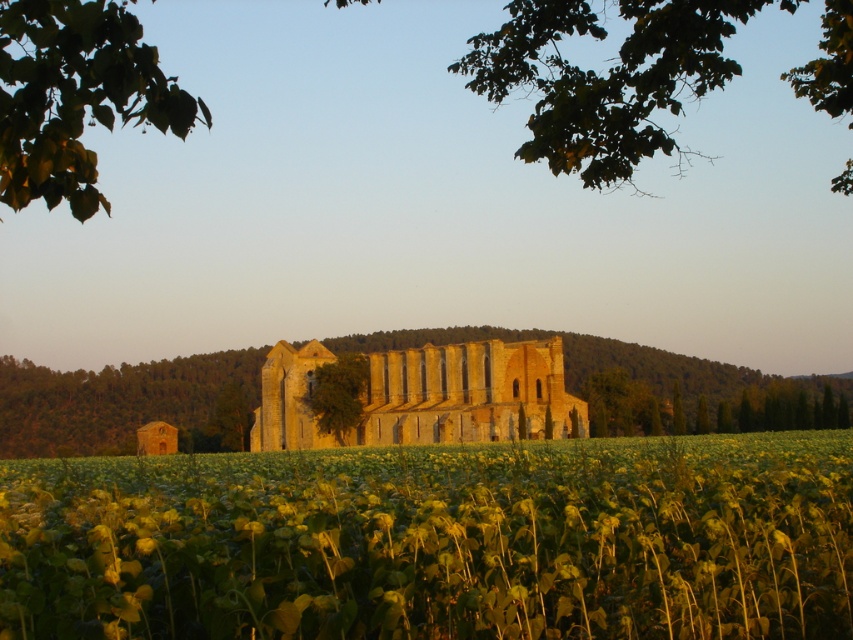
Question: Which object appears closest to the camera in this image?

Choices:
 (A) green leafy tree at center
 (B) green leafy vineyard at center
 (C) green leafy branch at upper left
 (D) brown stone building at center

Answer: (C)

Question: Which object appears closest to the camera in this image?

Choices:
 (A) green leafy tree at center
 (B) green leafy tree at upper right
 (C) green leafy vineyard at center

Answer: (C)

Question: Does brown stone building at center have a greater width compared to green leafy branch at upper left?

Choices:
 (A) yes
 (B) no

Answer: (A)

Question: Is green leafy vineyard at center smaller than green leafy tree at upper right?

Choices:
 (A) yes
 (B) no

Answer: (A)

Question: In this image, where is green leafy branch at upper left located relative to green leafy tree at center?

Choices:
 (A) right
 (B) left

Answer: (B)

Question: Which object is positioned farthest from the green leafy tree at center?

Choices:
 (A) green leafy branch at upper left
 (B) brown stone building at center
 (C) golden stone ruins at center
 (D) green leafy vineyard at center

Answer: (A)